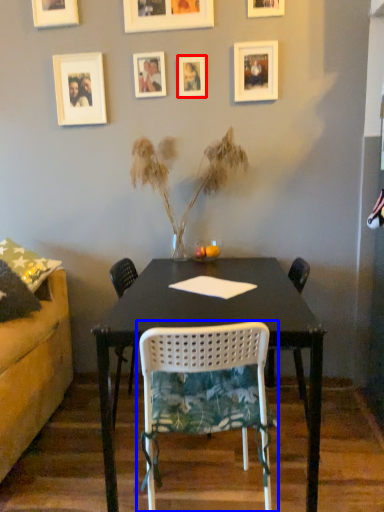
Question: Which point is further to the camera, picture frame (highlighted by a red box) or chair (highlighted by a blue box)?

Choices:
 (A) picture frame
 (B) chair

Answer: (A)